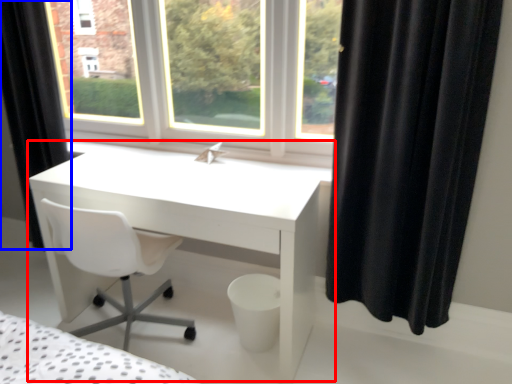
Question: Which of the following is the farthest to the observer, table (highlighted by a red box) or curtain (highlighted by a blue box)?

Choices:
 (A) table
 (B) curtain

Answer: (B)